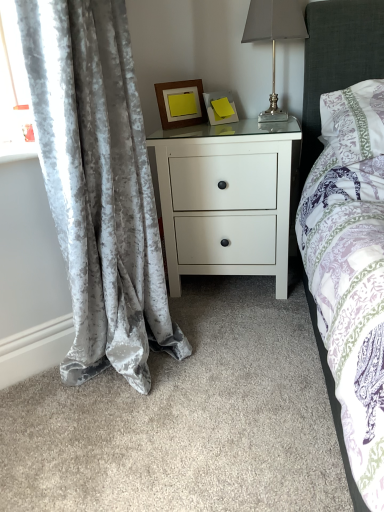
The image size is (384, 512). Find the location of `vacant point to the left of matte yellow picture frame at upper center, the 2th picture frame in the left-to-right sequence`. vacant point to the left of matte yellow picture frame at upper center, the 2th picture frame in the left-to-right sequence is located at coordinates (188, 126).